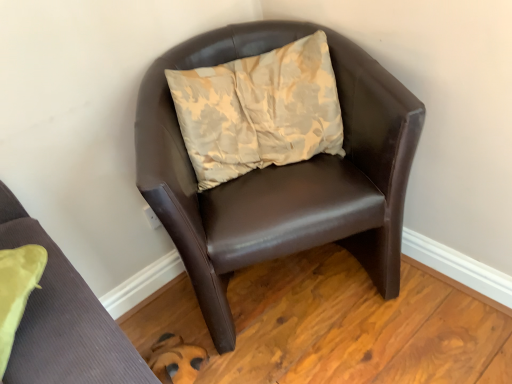
At what (x,y) coordinates should I click in order to perform the action: click on brown leather chair at upper right, which is the 2th chair from back to front. Please return your answer as a coordinate pair (x, y). Looking at the image, I should click on (63, 319).

Locate an element on the screen. beige floral cushion at center is located at coordinates (259, 110).

Identify the location of brown leather chair at upper right, acting as the first chair starting from the front. Image resolution: width=512 pixels, height=384 pixels. [63, 319].

From a real-world perspective, is brown leather chair at center, the first chair in the back-to-front sequence, under brown leather chair at upper right, which is the 2th chair from back to front?

Correct, in the physical world, brown leather chair at center, the first chair in the back-to-front sequence, is lower than brown leather chair at upper right, which is the 2th chair from back to front.

Would you say brown leather chair at center, acting as the second chair starting from the front, is outside brown leather chair at upper right, acting as the first chair starting from the front?

Yes, brown leather chair at center, acting as the second chair starting from the front, is not within brown leather chair at upper right, acting as the first chair starting from the front.

Can you tell me how much brown leather chair at center, the first chair in the back-to-front sequence, and brown leather chair at upper right, acting as the first chair starting from the front, differ in facing direction?

7.15 degrees separate the facing orientations of brown leather chair at center, the first chair in the back-to-front sequence, and brown leather chair at upper right, acting as the first chair starting from the front.

Is brown leather chair at center, the first chair in the back-to-front sequence, aimed at brown leather chair at upper right, acting as the first chair starting from the front?

No, brown leather chair at center, the first chair in the back-to-front sequence, is not aimed at brown leather chair at upper right, acting as the first chair starting from the front.

In order to click on pillow behind the brown leather chair at upper right, acting as the first chair starting from the front in this screenshot , I will do pos(259,110).

Consider the image. Can you confirm if beige floral cushion at center is shorter than brown leather chair at upper right, acting as the first chair starting from the front?

Correct, beige floral cushion at center is not as tall as brown leather chair at upper right, acting as the first chair starting from the front.

Looking at this image, is beige floral cushion at center with brown leather chair at upper right, acting as the first chair starting from the front?

No, beige floral cushion at center is not in contact with brown leather chair at upper right, acting as the first chair starting from the front.

In the scene shown: Is beige floral cushion at center further to the viewer compared to brown leather chair at upper right, acting as the first chair starting from the front?

Yes, it is behind brown leather chair at upper right, acting as the first chair starting from the front.

Is brown leather chair at center, acting as the second chair starting from the front, far away from beige floral cushion at center?

No, brown leather chair at center, acting as the second chair starting from the front, is not far away from beige floral cushion at center.

Consider the image. Considering the relative sizes of brown leather chair at center, the first chair in the back-to-front sequence, and beige floral cushion at center in the image provided, is brown leather chair at center, the first chair in the back-to-front sequence, bigger than beige floral cushion at center?

Yes.

Is brown leather chair at center, acting as the second chair starting from the front, in front of or behind beige floral cushion at center in the image?

In the image, brown leather chair at center, acting as the second chair starting from the front, appears in front of beige floral cushion at center.

Is beige floral cushion at center outside of brown leather chair at center, acting as the second chair starting from the front?

No, beige floral cushion at center is not outside of brown leather chair at center, acting as the second chair starting from the front.

Which object is further away from the camera taking this photo, beige floral cushion at center or brown leather chair at center, acting as the second chair starting from the front?

beige floral cushion at center is further from the camera.

Is brown leather chair at center, the first chair in the back-to-front sequence, at the back of beige floral cushion at center?

Yes, brown leather chair at center, the first chair in the back-to-front sequence, is at the back of beige floral cushion at center.

Between brown leather chair at upper right, which is the 2th chair from back to front, and brown leather chair at center, the first chair in the back-to-front sequence, which one has larger size?

With larger size is brown leather chair at center, the first chair in the back-to-front sequence.

Does point (55, 276) come closer to viewer compared to point (201, 234)?

That is True.

Can you tell me how much brown leather chair at upper right, acting as the first chair starting from the front, and brown leather chair at center, acting as the second chair starting from the front, differ in facing direction?

7.15 degrees.

I want to click on chair located on the left of brown leather chair at center, the first chair in the back-to-front sequence, so click(63, 319).

Is brown leather chair at upper right, acting as the first chair starting from the front, further to the viewer compared to beige floral cushion at center?

No, brown leather chair at upper right, acting as the first chair starting from the front, is closer to the viewer.

From the image's perspective, which is below, brown leather chair at upper right, which is the 2th chair from back to front, or beige floral cushion at center?

From the image's view, brown leather chair at upper right, which is the 2th chair from back to front, is below.

Which is behind, point (80, 373) or point (249, 131)?

Positioned behind is point (249, 131).

From a real-world perspective, is brown leather chair at upper right, which is the 2th chair from back to front, physically located above or below beige floral cushion at center?

In terms of real-world spatial position, brown leather chair at upper right, which is the 2th chair from back to front, is above beige floral cushion at center.

At what (x,y) coordinates should I click in order to perform the action: click on chair lying on the left of brown leather chair at center, acting as the second chair starting from the front. Please return your answer as a coordinate pair (x, y). The image size is (512, 384). Looking at the image, I should click on (x=63, y=319).

Where is `pillow lying behind the brown leather chair at upper right, acting as the first chair starting from the front`? This screenshot has height=384, width=512. pillow lying behind the brown leather chair at upper right, acting as the first chair starting from the front is located at coordinates (259, 110).

Which object lies further to the anchor point brown leather chair at center, acting as the second chair starting from the front, brown leather chair at upper right, acting as the first chair starting from the front, or beige floral cushion at center?

Based on the image, brown leather chair at upper right, acting as the first chair starting from the front, appears to be further to brown leather chair at center, acting as the second chair starting from the front.

Looking at the image, which one is located closer to brown leather chair at upper right, which is the 2th chair from back to front, brown leather chair at center, the first chair in the back-to-front sequence, or beige floral cushion at center?

Based on the image, brown leather chair at center, the first chair in the back-to-front sequence, appears to be nearer to brown leather chair at upper right, which is the 2th chair from back to front.

When comparing their distances from beige floral cushion at center, does brown leather chair at center, acting as the second chair starting from the front, or brown leather chair at upper right, which is the 2th chair from back to front, seem further?

Based on the image, brown leather chair at upper right, which is the 2th chair from back to front, appears to be further to beige floral cushion at center.

From the image, which object appears to be farther from brown leather chair at upper right, which is the 2th chair from back to front, beige floral cushion at center or brown leather chair at center, acting as the second chair starting from the front?

beige floral cushion at center is positioned further to the anchor brown leather chair at upper right, which is the 2th chair from back to front.

Looking at this image, based on their spatial positions, is beige floral cushion at center or brown leather chair at upper right, which is the 2th chair from back to front, further from brown leather chair at center, the first chair in the back-to-front sequence?

Among the two, brown leather chair at upper right, which is the 2th chair from back to front, is located further to brown leather chair at center, the first chair in the back-to-front sequence.

In the scene shown: Considering their positions, is brown leather chair at upper right, which is the 2th chair from back to front, positioned closer to beige floral cushion at center than brown leather chair at center, the first chair in the back-to-front sequence?

Among the two, brown leather chair at center, the first chair in the back-to-front sequence, is located nearer to beige floral cushion at center.

Locate an element on the screen. chair between brown leather chair at upper right, which is the 2th chair from back to front, and beige floral cushion at center from front to back is located at coordinates (281, 173).